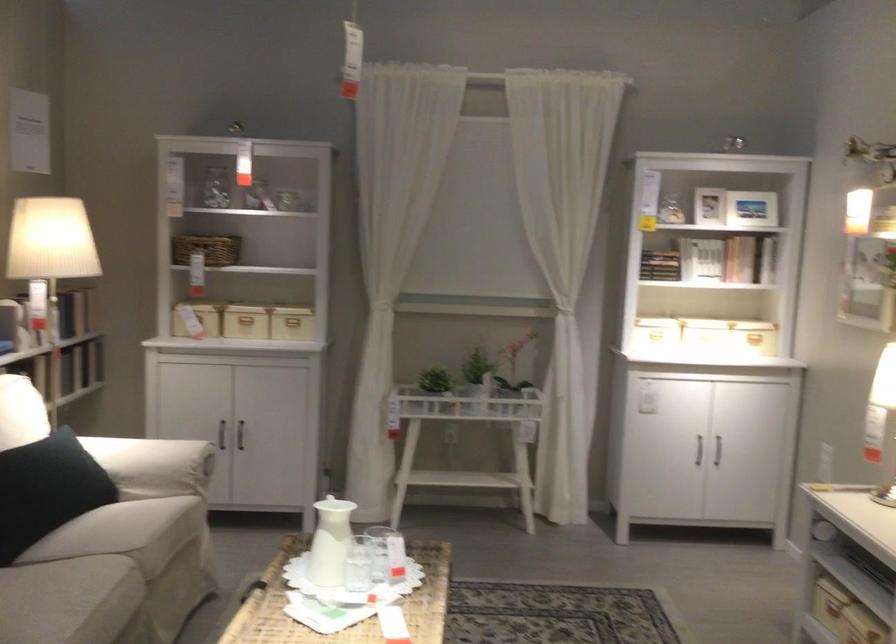
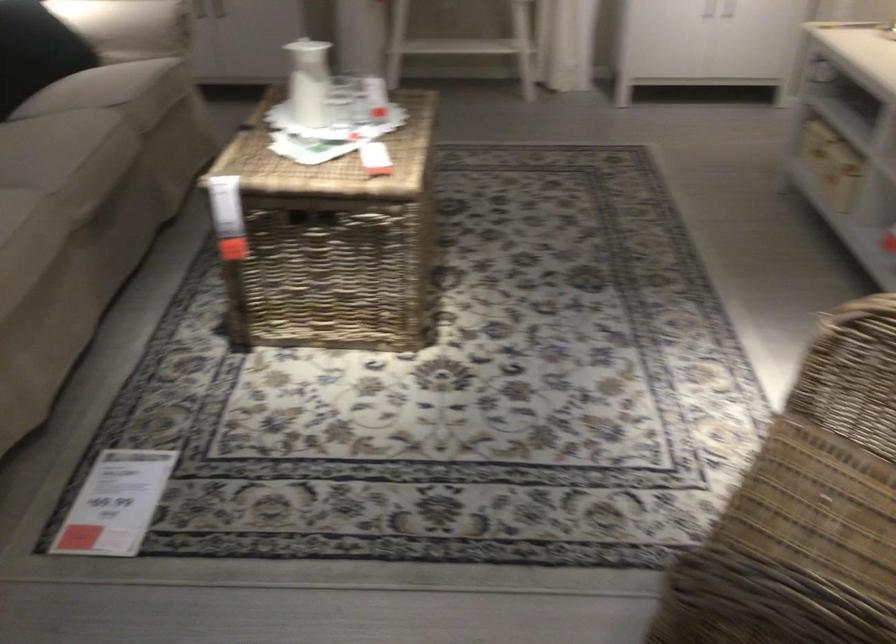
The images are taken continuously from a first-person perspective. In which direction are you moving?

The cameraman walked toward right, backward.